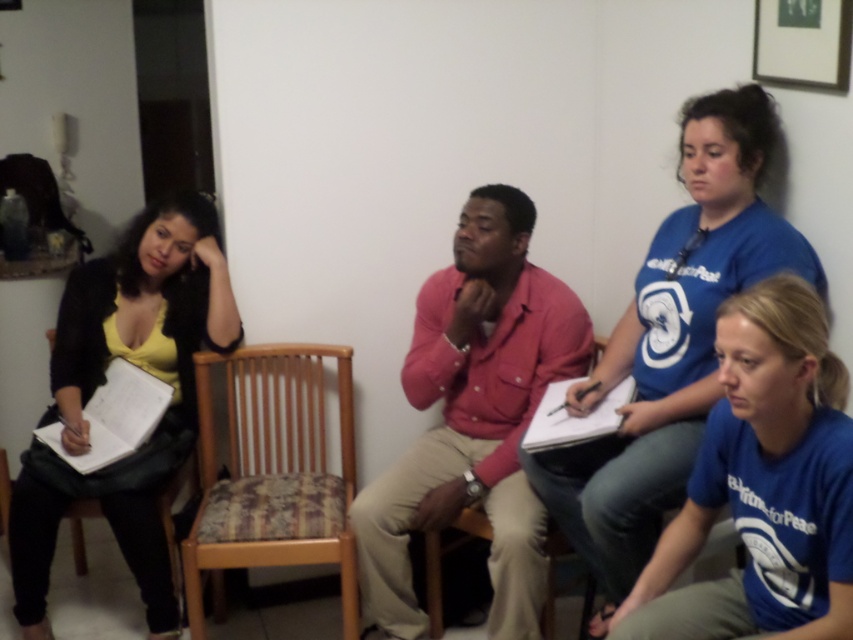
Question: Can you confirm if matte yellow shirt at left is thinner than woodenwoodenchair at center?

Choices:
 (A) no
 (B) yes

Answer: (A)

Question: Which of the following is the farthest from the observer?

Choices:
 (A) pink cotton shirt at center
 (B) blue cotton shirt at lower right

Answer: (A)

Question: Which object appears farthest from the camera in this image?

Choices:
 (A) blue cotton shirt at upper right
 (B) wooden chair at center
 (C) pink cotton shirt at center

Answer: (B)

Question: Among these points, which one is nearest to the camera?

Choices:
 (A) (228, 420)
 (B) (683, 566)
 (C) (583, 621)
 (D) (466, 214)

Answer: (B)

Question: Is blue cotton shirt at upper right smaller than woodenwoodenchair at center?

Choices:
 (A) yes
 (B) no

Answer: (B)

Question: In this image, where is pink cotton shirt at center located relative to blue cotton shirt at upper right?

Choices:
 (A) left
 (B) right

Answer: (A)